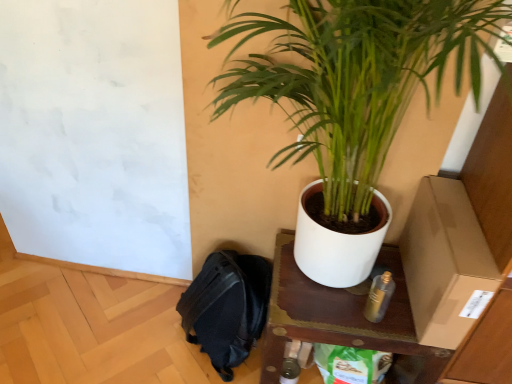
Measure the distance between brown cardboard box at right and camera.

brown cardboard box at right and camera are 95.12 centimeters apart from each other.

Identify the location of green glossy plant at upper right. The image size is (512, 384). (355, 79).

Describe the element at coordinates (355, 79) in the screenshot. The width and height of the screenshot is (512, 384). I see `green glossy plant at upper right` at that location.

Where is `brown cardboard box at right`? The width and height of the screenshot is (512, 384). brown cardboard box at right is located at coordinates (445, 263).

From a real-world perspective, which object stands above the other?

wooden table at center, from a real-world perspective.

In the scene shown: How distant is wooden table at center from black fabric backpack at lower left?

wooden table at center and black fabric backpack at lower left are 10.80 inches apart from each other.

Does wooden table at center have a smaller size compared to black fabric backpack at lower left?

No, wooden table at center is not smaller than black fabric backpack at lower left.

Is wooden table at center positioned with its back to black fabric backpack at lower left?

No, wooden table at center is not facing the opposite direction of black fabric backpack at lower left.

From a real-world perspective, between wooden table at center and metallic gold spray can at lower right, who is vertically lower?

wooden table at center is physically lower.

In the image, is wooden table at center positioned in front of or behind metallic gold spray can at lower right?

wooden table at center is positioned farther from the viewer than metallic gold spray can at lower right.

Between wooden table at center and metallic gold spray can at lower right, which one appears on the right side from the viewer's perspective?

From the viewer's perspective, metallic gold spray can at lower right appears more on the right side.

Can you confirm if wooden table at center is smaller than metallic gold spray can at lower right?

No, wooden table at center is not smaller than metallic gold spray can at lower right.

Is black fabric backpack at lower left wider or thinner than metallic gold spray can at lower right?

black fabric backpack at lower left is wider than metallic gold spray can at lower right.

Which object is positioned more to the left, black fabric backpack at lower left or metallic gold spray can at lower right?

Positioned to the left is black fabric backpack at lower left.

How many degrees apart are the facing directions of metallic gold spray can at lower right and wooden table at center?

0.0014 degrees.

Which is more to the left, metallic gold spray can at lower right or wooden table at center?

wooden table at center.

Locate an element on the screen. The width and height of the screenshot is (512, 384). table below the metallic gold spray can at lower right (from a real-world perspective) is located at coordinates (341, 316).

Choose the correct answer: Is metallic gold spray can at lower right inside wooden table at center or outside it?

metallic gold spray can at lower right is located beyond the bounds of wooden table at center.

This screenshot has width=512, height=384. Identify the location of houseplant in front of the metallic gold spray can at lower right. [x=355, y=79].

Which is correct: green glossy plant at upper right is inside metallic gold spray can at lower right, or outside of it?

green glossy plant at upper right is spatially situated outside metallic gold spray can at lower right.

Are green glossy plant at upper right and metallic gold spray can at lower right located far from each other?

Actually, green glossy plant at upper right and metallic gold spray can at lower right are a little close together.

Considering the sizes of objects wooden table at center and brown cardboard box at right in the image provided, who is thinner, wooden table at center or brown cardboard box at right?

Thinner between the two is brown cardboard box at right.

From a real-world perspective, who is located lower, wooden table at center or brown cardboard box at right?

From a 3D spatial view, wooden table at center is below.

Is wooden table at center oriented towards brown cardboard box at right?

No, wooden table at center is not turned towards brown cardboard box at right.

From the image's perspective, which is below, wooden table at center or brown cardboard box at right?

wooden table at center is shown below in the image.

What's the angular difference between green glossy plant at upper right and wooden table at center's facing directions?

1.37 degrees.

In the image, there is a wooden table at center. In order to click on houseplant above it (from the image's perspective) in this screenshot , I will do `click(355, 79)`.

Is green glossy plant at upper right taller than wooden table at center?

Indeed, green glossy plant at upper right has a greater height compared to wooden table at center.

Does green glossy plant at upper right come behind wooden table at center?

No.

You are a GUI agent. You are given a task and a screenshot of the screen. Output one action in this format:
    pyautogui.click(x=<x>, y=<y>)
    Task: Click on the backpack that is above the wooden table at center (from the image's perspective)
    The width and height of the screenshot is (512, 384).
    Given the screenshot: What is the action you would take?
    pyautogui.click(x=227, y=307)

What are the coordinates of `table lying behind the metallic gold spray can at lower right` in the screenshot? It's located at pos(341,316).

Which object lies nearer to the anchor point wooden table at center, black fabric backpack at lower left or brown cardboard box at right?

brown cardboard box at right lies closer to wooden table at center than the other object.

Estimate the real-world distances between objects in this image. Which object is closer to green glossy plant at upper right, brown cardboard box at right or black fabric backpack at lower left?

The object closer to green glossy plant at upper right is brown cardboard box at right.

Looking at the image, which one is located closer to green glossy plant at upper right, metallic gold spray can at lower right or brown cardboard box at right?

brown cardboard box at right is closer to green glossy plant at upper right.

When comparing their distances from brown cardboard box at right, does metallic gold spray can at lower right or green glossy plant at upper right seem further?

Among the two, green glossy plant at upper right is located further to brown cardboard box at right.

When comparing their distances from brown cardboard box at right, does wooden table at center or metallic gold spray can at lower right seem closer?

The object closer to brown cardboard box at right is metallic gold spray can at lower right.

When comparing their distances from brown cardboard box at right, does wooden table at center or black fabric backpack at lower left seem further?

Based on the image, black fabric backpack at lower left appears to be further to brown cardboard box at right.

When comparing their distances from black fabric backpack at lower left, does green glossy plant at upper right or metallic gold spray can at lower right seem closer?

Based on the image, metallic gold spray can at lower right appears to be nearer to black fabric backpack at lower left.

Estimate the real-world distances between objects in this image. Which object is closer to metallic gold spray can at lower right, green glossy plant at upper right or wooden table at center?

wooden table at center lies closer to metallic gold spray can at lower right than the other object.

At what (x,y) coordinates should I click in order to perform the action: click on backpack between green glossy plant at upper right and wooden table at center from top to bottom. Please return your answer as a coordinate pair (x, y). The image size is (512, 384). Looking at the image, I should click on (227, 307).

Identify the location of cardboard box between green glossy plant at upper right and wooden table at center from top to bottom. The width and height of the screenshot is (512, 384). (445, 263).

This screenshot has height=384, width=512. In order to click on table between black fabric backpack at lower left and metallic gold spray can at lower right in the horizontal direction in this screenshot , I will do `click(341, 316)`.

Identify the location of bottle between green glossy plant at upper right and brown cardboard box at right from left to right. (379, 297).